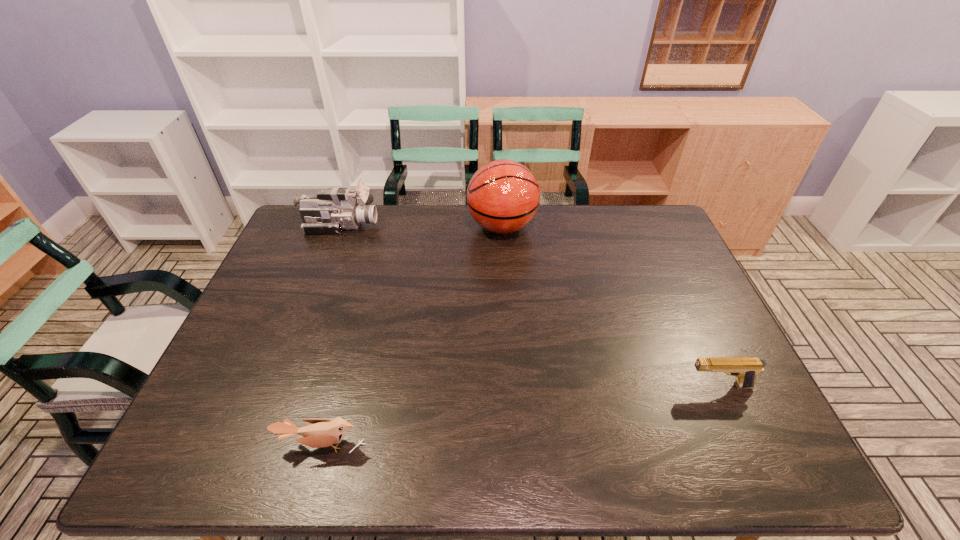
Identify the location of free region located at the barrel of the third farthest object. (549, 386).

Where is `free space located 0.330m at the barrel of the third farthest object`? free space located 0.330m at the barrel of the third farthest object is located at coordinates (549, 386).

Find the location of a particular element. The image size is (960, 540). vacant area situated 0.290m at the barrel of the third farthest object is located at coordinates (565, 386).

Locate an element on the screen. basketball that is at the far edge is located at coordinates (503, 196).

At what (x,y) coordinates should I click in order to perform the action: click on camcorder at the far edge. Please return your answer as a coordinate pair (x, y). The image size is (960, 540). Looking at the image, I should click on (332, 210).

Find the location of a particular element. object situated at the near edge is located at coordinates (322, 433).

At what (x,y) coordinates should I click in order to perform the action: click on object present at the left edge. Please return your answer as a coordinate pair (x, y). The width and height of the screenshot is (960, 540). Looking at the image, I should click on (332, 210).

This screenshot has height=540, width=960. What are the coordinates of `object that is at the right edge` in the screenshot? It's located at (745, 369).

Where is `object positioned at the far left corner`? The image size is (960, 540). object positioned at the far left corner is located at coordinates (332, 210).

Where is `vacant area at the far edge of the desktop`? The width and height of the screenshot is (960, 540). vacant area at the far edge of the desktop is located at coordinates (375, 227).